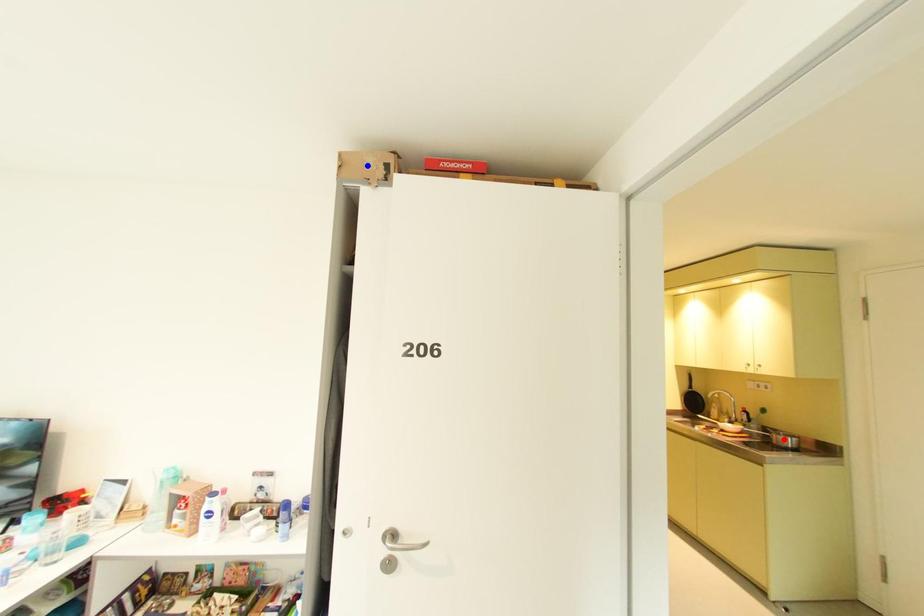
Question: Two points are marked on the image. Which point is closer to the camera?

Choices:
 (A) Blue point is closer.
 (B) Red point is closer.

Answer: (A)